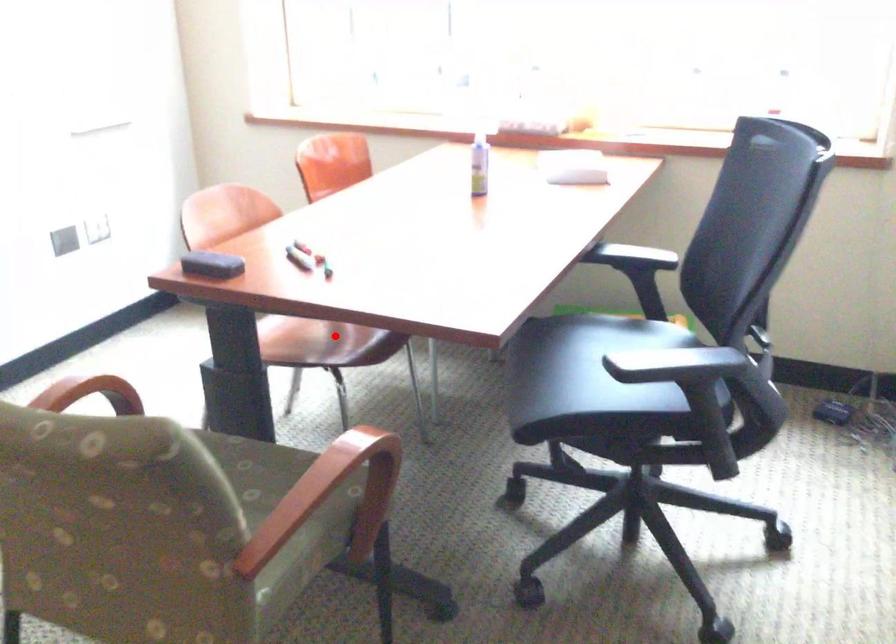
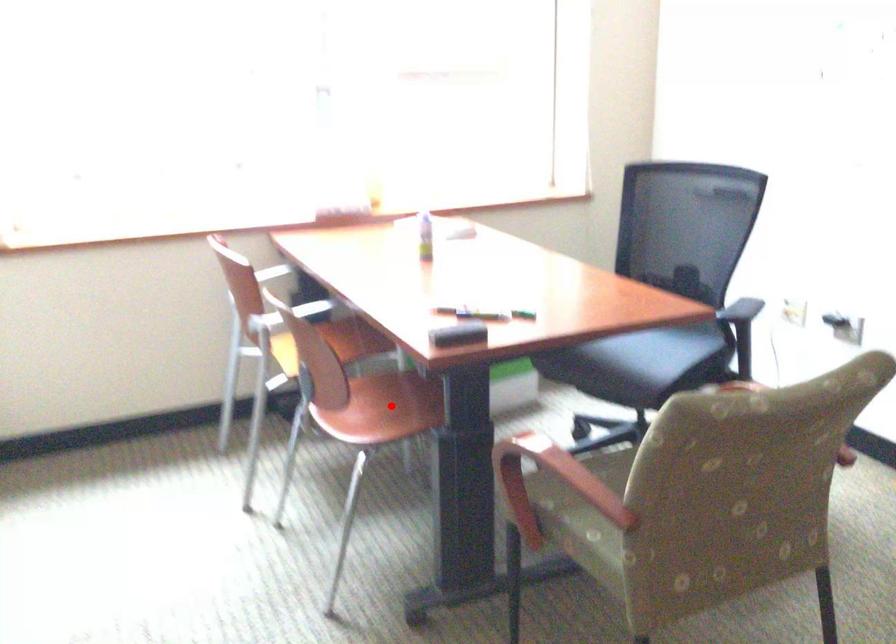
I am providing you with two images of the same scene from different viewpoints. A red point is marked on the first image and another point is marked on the second image. Does the point marked in image1 correspond to the same location as the one in image2?

Yes